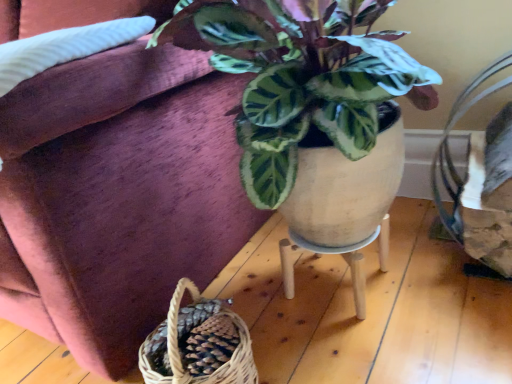
Question: In the image, is wooden stool at center positioned in front of or behind velvet couch at upper left?

Choices:
 (A) front
 (B) behind

Answer: (B)

Question: Which is correct: wooden stool at center is inside velvet couch at upper left, or outside of it?

Choices:
 (A) inside
 (B) outside

Answer: (B)

Question: In terms of size, does wooden stool at center appear bigger or smaller than velvet couch at upper left?

Choices:
 (A) big
 (B) small

Answer: (B)

Question: In the image, is velvet couch at upper left on the left side or the right side of wooden stool at center?

Choices:
 (A) right
 (B) left

Answer: (B)

Question: Is velvet couch at upper left wider or thinner than wooden stool at center?

Choices:
 (A) wide
 (B) thin

Answer: (A)

Question: Do you think velvet couch at upper left is within wooden stool at center, or outside of it?

Choices:
 (A) outside
 (B) inside

Answer: (A)

Question: From the image's perspective, is velvet couch at upper left above or below wooden stool at center?

Choices:
 (A) above
 (B) below

Answer: (A)